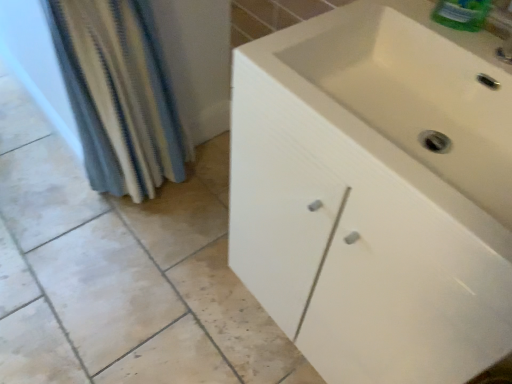
What do you see at coordinates (119, 94) in the screenshot?
I see `blue striped fabric at left` at bounding box center [119, 94].

Locate an element on the screen. blue striped fabric at left is located at coordinates (119, 94).

Measure the distance between blue striped fabric at left and camera.

1.01 meters.

Measure the distance between point (114, 92) and camera.

The depth of point (114, 92) is 1.21 meters.

Image resolution: width=512 pixels, height=384 pixels. What do you see at coordinates (376, 192) in the screenshot?
I see `white matte cabinet at center` at bounding box center [376, 192].

What is the approximate width of white matte cabinet at center?

46.41 centimeters.

The height and width of the screenshot is (384, 512). Find the location of `white matte cabinet at center`. white matte cabinet at center is located at coordinates (376, 192).

This screenshot has height=384, width=512. Identify the location of blue striped fabric at left. tap(119, 94).

In the image, is blue striped fabric at left on the left side or the right side of white matte cabinet at center?

blue striped fabric at left is to the left of white matte cabinet at center.

Which object is closer to the camera, blue striped fabric at left or white matte cabinet at center?

white matte cabinet at center.

Considering the positions of points (121, 21) and (301, 66), is point (121, 21) farther from camera compared to point (301, 66)?

Yes, point (121, 21) is behind point (301, 66).

From the image's perspective, who appears lower, blue striped fabric at left or white matte cabinet at center?

white matte cabinet at center appears lower in the image.

From a real-world perspective, which is physically below, blue striped fabric at left or white matte cabinet at center?

white matte cabinet at center is physically lower.

Considering the relative sizes of blue striped fabric at left and white matte cabinet at center in the image provided, is blue striped fabric at left wider than white matte cabinet at center?

No.

Does blue striped fabric at left have a greater height compared to white matte cabinet at center?

Indeed, blue striped fabric at left has a greater height compared to white matte cabinet at center.

Does blue striped fabric at left have a larger size compared to white matte cabinet at center?

Actually, blue striped fabric at left might be smaller than white matte cabinet at center.

Consider the image. Is blue striped fabric at left situated inside white matte cabinet at center or outside?

blue striped fabric at left is not inside white matte cabinet at center, it's outside.

Is blue striped fabric at left far away from white matte cabinet at center?

No.

Is blue striped fabric at left facing towards white matte cabinet at center?

Yes, blue striped fabric at left is aimed at white matte cabinet at center.

What's the angular difference between blue striped fabric at left and white matte cabinet at center's facing directions?

The angular difference between blue striped fabric at left and white matte cabinet at center is 88 degrees.

How distant is blue striped fabric at left from white matte cabinet at center?

blue striped fabric at left and white matte cabinet at center are 27.48 inches apart from each other.

Where is `bathroom cabinet below the blue striped fabric at left (from a real-world perspective)`? bathroom cabinet below the blue striped fabric at left (from a real-world perspective) is located at coordinates (376, 192).

Does white matte cabinet at center appear on the right side of blue striped fabric at left?

Yes.

Is the depth of white matte cabinet at center greater than that of blue striped fabric at left?

No, it is not.

Which point is more forward, (333, 161) or (132, 65)?

The point (333, 161) is closer.

From the image's perspective, would you say white matte cabinet at center is shown under blue striped fabric at left?

Yes, from the image's perspective, white matte cabinet at center is below blue striped fabric at left.

From a real-world perspective, does white matte cabinet at center stand above blue striped fabric at left?

No, from a real-world perspective, white matte cabinet at center is not on top of blue striped fabric at left.

Looking at their sizes, would you say white matte cabinet at center is wider or thinner than blue striped fabric at left?

Clearly, white matte cabinet at center has more width compared to blue striped fabric at left.

Is white matte cabinet at center taller than blue striped fabric at left?

In fact, white matte cabinet at center may be shorter than blue striped fabric at left.

Does white matte cabinet at center have a larger size compared to blue striped fabric at left?

Indeed, white matte cabinet at center has a larger size compared to blue striped fabric at left.

Is white matte cabinet at center completely or partially outside of blue striped fabric at left?

That's correct, white matte cabinet at center is outside of blue striped fabric at left.

Is white matte cabinet at center beside blue striped fabric at left?

No, white matte cabinet at center is not touching blue striped fabric at left.

Is white matte cabinet at center looking in the opposite direction of blue striped fabric at left?

white matte cabinet at center is not turned away from blue striped fabric at left.

How many degrees apart are the facing directions of white matte cabinet at center and blue striped fabric at left?

white matte cabinet at center and blue striped fabric at left are facing 88 degrees away from each other.

This screenshot has width=512, height=384. What are the coordinates of `bathroom cabinet lying in front of the blue striped fabric at left` in the screenshot? It's located at (376, 192).

Locate an element on the screen. Image resolution: width=512 pixels, height=384 pixels. bathroom cabinet below the blue striped fabric at left (from the image's perspective) is located at coordinates (376, 192).

What are the coordinates of `shower curtain located above the white matte cabinet at center (from the image's perspective)` in the screenshot? It's located at (119, 94).